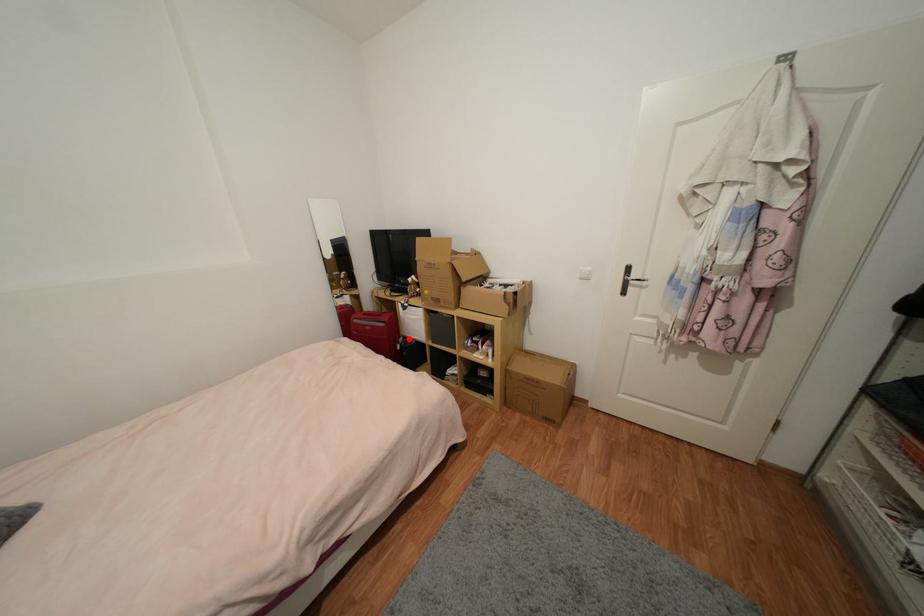
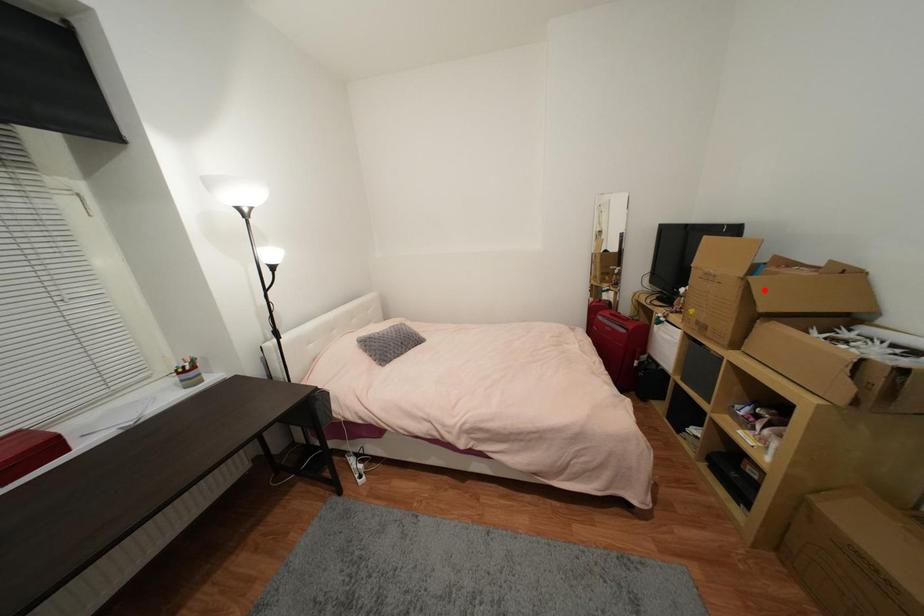
I am providing you with two images of the same scene from different viewpoints. A red point is marked on the first image and another point is marked on the second image. Do the highlighted points in image1 and image2 indicate the same real-world spot?

No